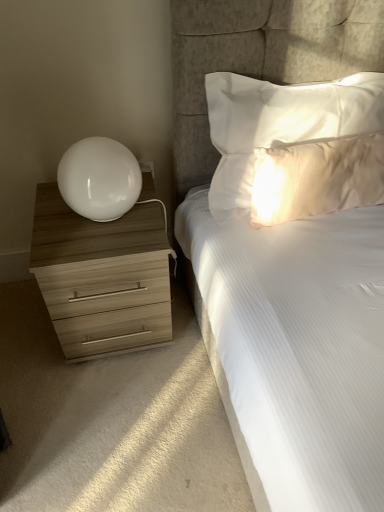
Where is `free location in front of wooden chest of drawers at left`? The width and height of the screenshot is (384, 512). free location in front of wooden chest of drawers at left is located at coordinates (106, 403).